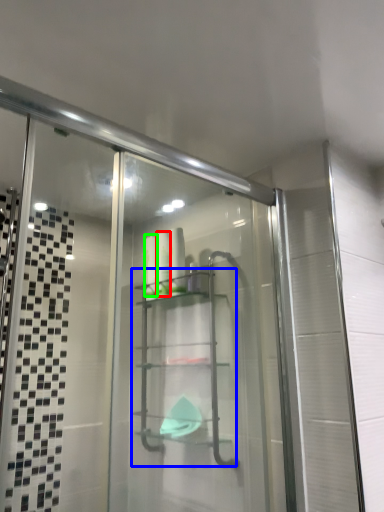
Question: Which object is positioned closest to toiletry (highlighted by a red box)? Select from glass box (highlighted by a blue box) and toiletry (highlighted by a green box).

Choices:
 (A) glass box
 (B) toiletry

Answer: (B)